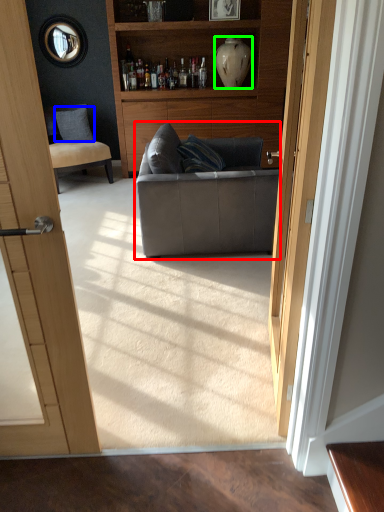
Question: Which is nearer to the studio couch (highlighted by a red box)? pillow (highlighted by a blue box) or vase (highlighted by a green box).

Choices:
 (A) pillow
 (B) vase

Answer: (B)